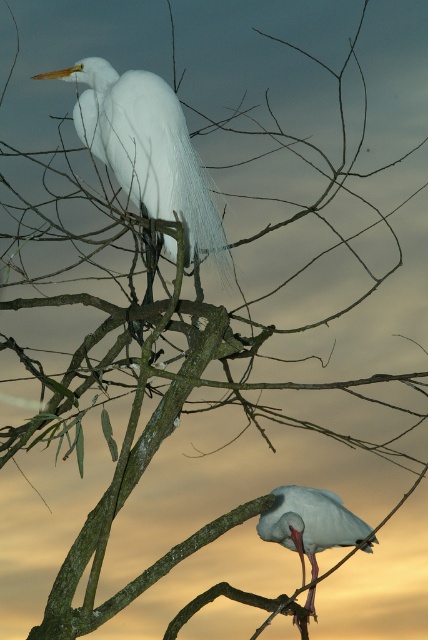
Question: Which point appears farthest from the camera in this image?

Choices:
 (A) (344, 531)
 (B) (183, 118)

Answer: (A)

Question: In this image, where is matte white egret at upper center located relative to white matte bird at lower right?

Choices:
 (A) above
 (B) below

Answer: (A)

Question: Considering the relative positions of matte white egret at upper center and white matte bird at lower right in the image provided, where is matte white egret at upper center located with respect to white matte bird at lower right?

Choices:
 (A) above
 (B) below

Answer: (A)

Question: Which point is farther to the camera?

Choices:
 (A) (169, 124)
 (B) (362, 532)

Answer: (B)

Question: Does matte white egret at upper center lie behind white matte bird at lower right?

Choices:
 (A) no
 (B) yes

Answer: (A)